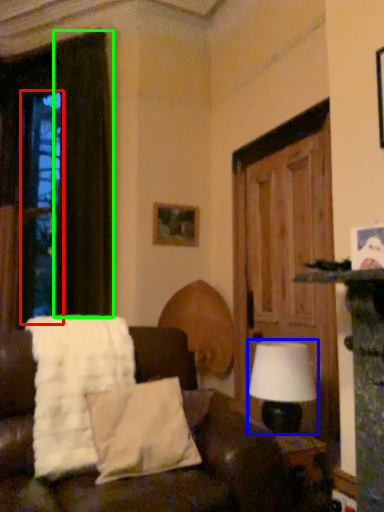
Question: Considering the real-world distances, which object is closest to window (highlighted by a red box)? table lamp (highlighted by a blue box) or curtain (highlighted by a green box).

Choices:
 (A) table lamp
 (B) curtain

Answer: (B)